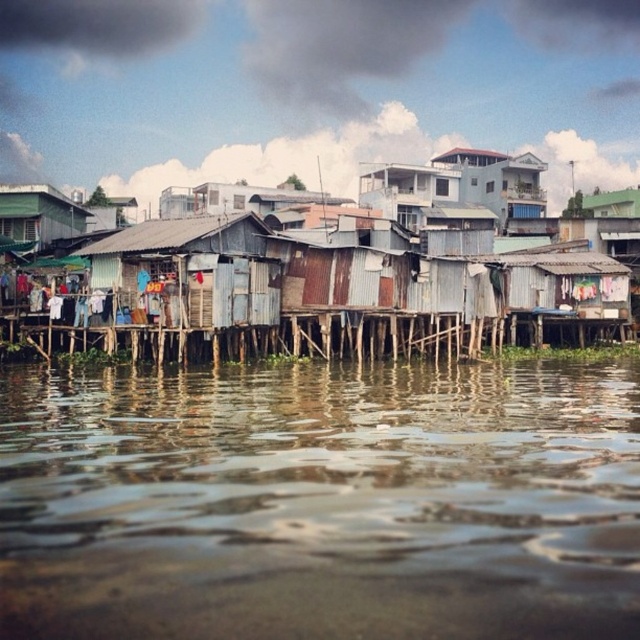
Consider the image. Is brown reflective water at lower center positioned in front of rusty corrugated metal hut at center?

Yes, it is in front of rusty corrugated metal hut at center.

Where is `brown reflective water at lower center`? The height and width of the screenshot is (640, 640). brown reflective water at lower center is located at coordinates (321, 500).

Between rusty corrugated metal hut at center and green corrugated metal hut at left, which one has more height?

green corrugated metal hut at left

Between rusty corrugated metal hut at center and green corrugated metal hut at left, which one appears on the right side from the viewer's perspective?

rusty corrugated metal hut at center

Find the location of `rusty corrugated metal hut at center`. rusty corrugated metal hut at center is located at coordinates (195, 266).

This screenshot has width=640, height=640. In order to click on rusty corrugated metal hut at center in this screenshot , I will do `click(195, 266)`.

Does rusty corrugated metal shacks at center have a lesser height compared to green corrugated metal hut at left?

No, rusty corrugated metal shacks at center is not shorter than green corrugated metal hut at left.

Does rusty corrugated metal shacks at center have a smaller size compared to green corrugated metal hut at left?

Incorrect, rusty corrugated metal shacks at center is not smaller in size than green corrugated metal hut at left.

Between point (516, 264) and point (24, 224), which one is positioned behind?

Point (24, 224)

Find the location of a particular element. rusty corrugated metal shacks at center is located at coordinates (358, 266).